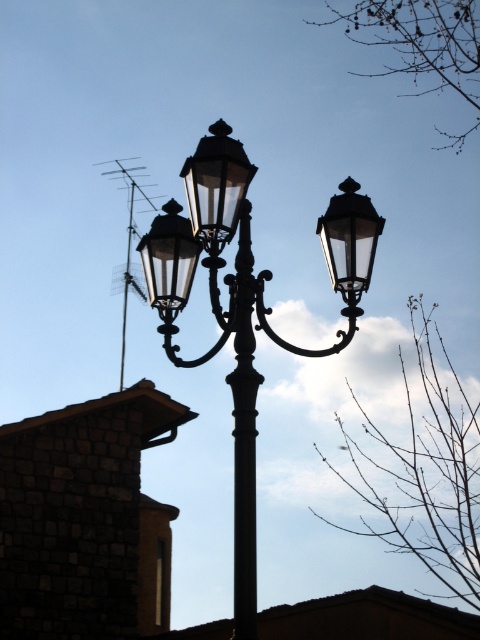
Question: Which of the following is the closest to the observer?

Choices:
 (A) black wrought iron pole at center
 (B) matte glass streetlight at upper right
 (C) matte black streetlight at center

Answer: (A)

Question: Can you confirm if black glass street light at center is thinner than matte glass streetlight at center?

Choices:
 (A) yes
 (B) no

Answer: (B)

Question: Does matte black streetlight at center come behind matte glass streetlight at center?

Choices:
 (A) yes
 (B) no

Answer: (B)

Question: Which is farther from the matte black streetlight at center?

Choices:
 (A) black wrought iron pole at center
 (B) matte glass streetlight at center

Answer: (A)

Question: Among these points, which one is nearest to the camera?

Choices:
 (A) (164, 236)
 (B) (229, 285)
 (C) (188, 259)
 (D) (158, 253)

Answer: (B)

Question: Does black glass street light at center have a smaller size compared to matte glass streetlight at upper right?

Choices:
 (A) no
 (B) yes

Answer: (A)